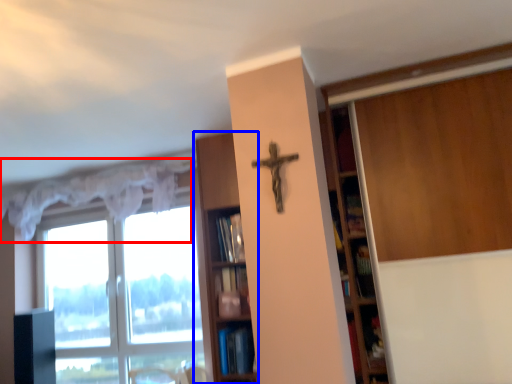
Question: Which object appears farthest to the camera in this image, curtain (highlighted by a red box) or shelf (highlighted by a blue box)?

Choices:
 (A) curtain
 (B) shelf

Answer: (A)